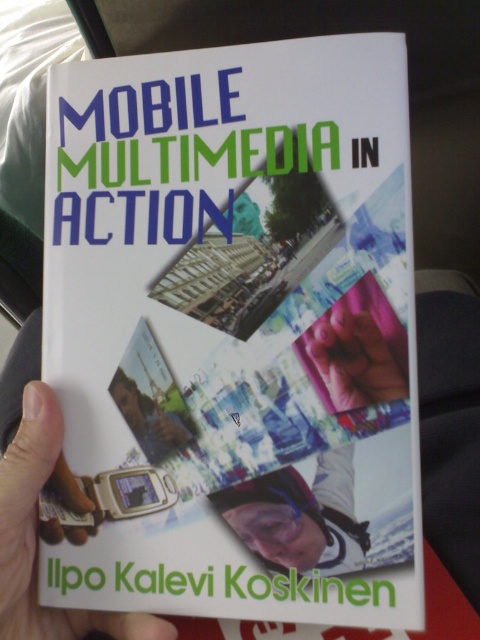
Based on the photo, you are designing a poster for a tech event and need to place the matte black helmet at center and the matte plastic phone at lower left. If the poster has a width limit of 12 inches, which object might not fit if placed side by side?

The matte black helmet at center has a greater width than the matte plastic phone at lower left. Therefore, the matte black helmet at center might not fit if placed side by side within the 12 inch width limit.